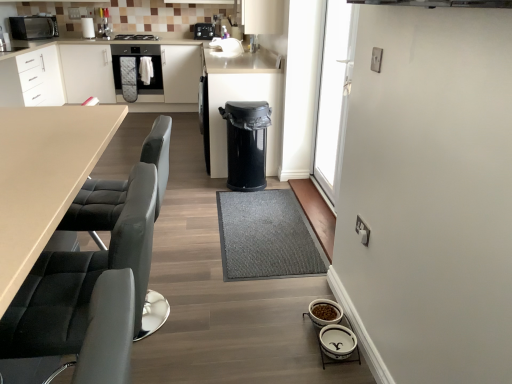
Where is `free space between transparent glass door at upper right and black plastic trash can at center`? free space between transparent glass door at upper right and black plastic trash can at center is located at coordinates (286, 192).